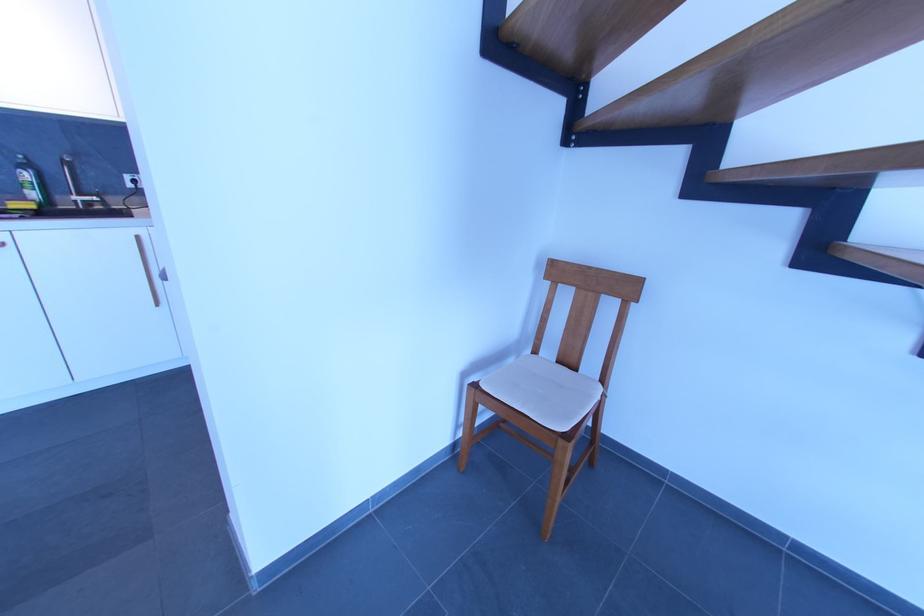
Find the location of `yellow sponge`. yellow sponge is located at coordinates (20, 205).